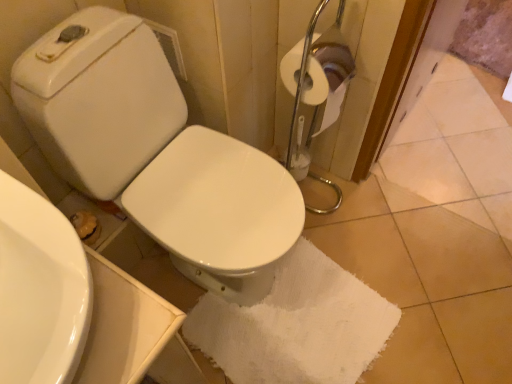
At what (x,y) coordinates should I click in order to perform the action: click on white cotton bath towel at center. Please return your answer as a coordinate pair (x, y). Looking at the image, I should click on (296, 325).

In order to face white glossy sink at lower left, should I rotate leftwards or rightwards?

Rotate left and turn 28.916 degrees.

Locate an element on the screen. The image size is (512, 384). white cotton bath towel at center is located at coordinates (296, 325).

Considering the positions of objects white cotton bath towel at center and white glossy sink at lower left in the image provided, who is more to the right, white cotton bath towel at center or white glossy sink at lower left?

white cotton bath towel at center is more to the right.

Between white cotton bath towel at center and white glossy sink at lower left, which one has larger width?

white cotton bath towel at center.

In terms of height, does white cotton bath towel at center look taller or shorter compared to white glossy sink at lower left?

white cotton bath towel at center is shorter than white glossy sink at lower left.

Based on their sizes in the image, would you say white cotton bath towel at center is bigger or smaller than white glossy sink at lower left?

Clearly, white cotton bath towel at center is larger in size than white glossy sink at lower left.

How many degrees apart are the facing directions of white glossy sink at lower left and white cotton bath towel at center?

The angle between the facing direction of white glossy sink at lower left and the facing direction of white cotton bath towel at center is 84.9 degrees.

Would you say white glossy sink at lower left contains white cotton bath towel at center?

No, white cotton bath towel at center is not surrounded by white glossy sink at lower left.

At what (x,y) coordinates should I click in order to perform the action: click on bath towel below the white glossy sink at lower left (from the image's perspective). Please return your answer as a coordinate pair (x, y). Image resolution: width=512 pixels, height=384 pixels. Looking at the image, I should click on (296, 325).

Considering the sizes of objects white glossy toilet at center and white glossy sink at lower left in the image provided, who is wider, white glossy toilet at center or white glossy sink at lower left?

With larger width is white glossy toilet at center.

Is white glossy toilet at center located outside white glossy sink at lower left?

white glossy toilet at center lies outside white glossy sink at lower left's area.

Consider the image. From the image's perspective, is white glossy toilet at center above or below white glossy sink at lower left?

Clearly, from the image's perspective, white glossy toilet at center is above white glossy sink at lower left.

Is white glossy toilet at center looking in the opposite direction of white glossy sink at lower left?

No.

What's the angular difference between white glossy sink at lower left and white glossy toilet at center's facing directions?

They differ by 1.29 degrees in their facing directions.

From the image's perspective, is white glossy sink at lower left below white glossy toilet at center?

Yes.

This screenshot has width=512, height=384. In order to click on toilet above the white glossy sink at lower left (from the image's perspective) in this screenshot , I will do `click(156, 153)`.

Based on their sizes in the image, would you say white glossy sink at lower left is bigger or smaller than white glossy toilet at center?

Considering their sizes, white glossy sink at lower left takes up less space than white glossy toilet at center.

In the scene shown: How many degrees apart are the facing directions of white glossy toilet at center and white cotton bath towel at center?

The angular difference between white glossy toilet at center and white cotton bath towel at center is 83.6 degrees.

Does white glossy toilet at center have a greater width compared to white cotton bath towel at center?

Yes, white glossy toilet at center is wider than white cotton bath towel at center.

Is white glossy toilet at center looking in the opposite direction of white cotton bath towel at center?

white glossy toilet at center is not turned away from white cotton bath towel at center.

Considering the sizes of objects white glossy toilet at center and white cotton bath towel at center in the image provided, who is shorter, white glossy toilet at center or white cotton bath towel at center?

With less height is white cotton bath towel at center.

From the image's perspective, which is above, white cotton bath towel at center or white glossy toilet at center?

white glossy toilet at center is shown above in the image.

Can you confirm if white cotton bath towel at center is wider than white glossy toilet at center?

Incorrect, the width of white cotton bath towel at center does not surpass that of white glossy toilet at center.

From a real-world perspective, does white cotton bath towel at center sit lower than white glossy toilet at center?

Yes.

Is white cotton bath towel at center facing towards white glossy toilet at center?

No, white cotton bath towel at center is not oriented towards white glossy toilet at center.

The image size is (512, 384). In the image, there is a white glossy sink at lower left. Identify the location of bath towel below it (from the image's perspective). (296, 325).

At what (x,y) coordinates should I click in order to perform the action: click on bath towel behind the white glossy sink at lower left. Please return your answer as a coordinate pair (x, y). This screenshot has height=384, width=512. Looking at the image, I should click on (296, 325).

Based on their spatial positions, is white cotton bath towel at center or white glossy toilet at center further from white glossy sink at lower left?

white cotton bath towel at center.

Considering their positions, is white glossy toilet at center positioned further to white glossy sink at lower left than white cotton bath towel at center?

white cotton bath towel at center lies further to white glossy sink at lower left than the other object.

Based on their spatial positions, is white glossy sink at lower left or white cotton bath towel at center further from white glossy toilet at center?

white cotton bath towel at center lies further to white glossy toilet at center than the other object.

Looking at the image, which one is located further to white cotton bath towel at center, white glossy toilet at center or white glossy sink at lower left?

Among the two, white glossy sink at lower left is located further to white cotton bath towel at center.

When comparing their distances from white cotton bath towel at center, does white glossy sink at lower left or white glossy toilet at center seem closer?

white glossy toilet at center is positioned closer to the anchor white cotton bath towel at center.

Considering their positions, is white cotton bath towel at center positioned further to white glossy toilet at center than white glossy sink at lower left?

white cotton bath towel at center.

You are a GUI agent. You are given a task and a screenshot of the screen. Output one action in this format:
    pyautogui.click(x=<x>, y=<y>)
    Task: Click on the toilet between white glossy sink at lower left and white cotton bath towel at center in the front-back direction
    
    Given the screenshot: What is the action you would take?
    pyautogui.click(x=156, y=153)